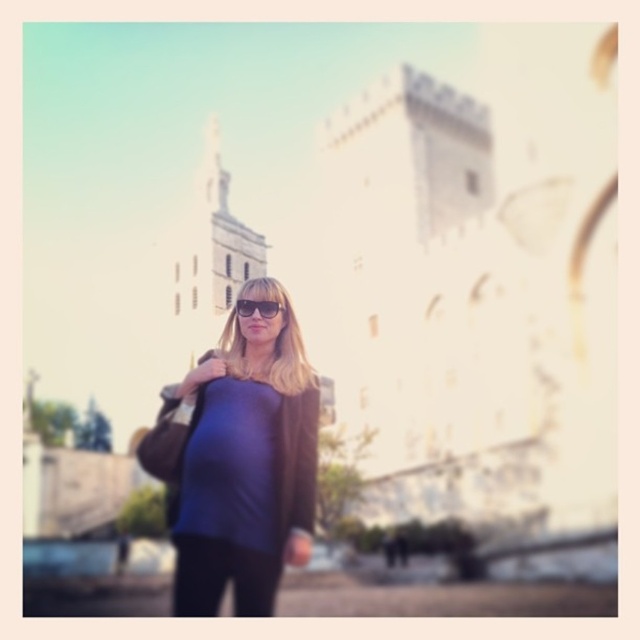
You are a photographer taking a portrait of the person in the scene. You want to ensure the matte blue shirt at center and the matte black sunglasses at center are both visible in the frame. Which object should you position closer to the left side of the frame?

The matte blue shirt at center is to the left of the matte black sunglasses at center, so to ensure both are visible, position the matte blue shirt at center closer to the left side of the frame.

You are a photographer trying to capture the person in the image. The person is standing at point (240, 460). You want to ensure the matte blue shirt at center is in focus. Which part of the person should you focus on to capture the matte blue shirt at center?

The matte blue shirt at center is located at point (240, 460), so you should focus on that point to ensure the matte blue shirt at center is in focus.

You are a fashion designer analyzing the image. You need to determine which item has a greater horizontal span between the matte blue shirt at center and the matte black sunglasses at center. Which one is wider?

The matte blue shirt at center has a greater width than the matte black sunglasses at center, so the shirt is wider.